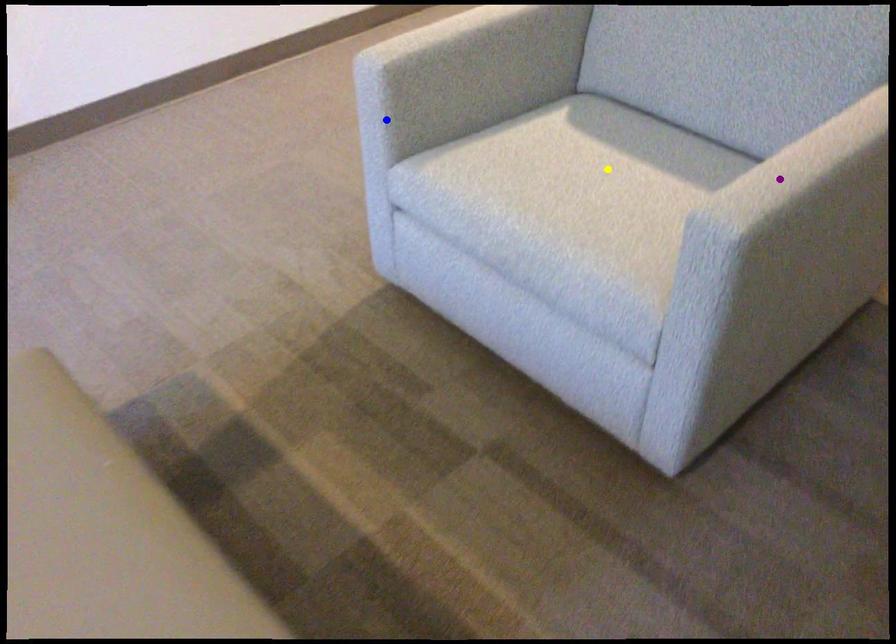
Order these from nearest to farthest:
- blue point
- yellow point
- purple point

1. purple point
2. blue point
3. yellow point